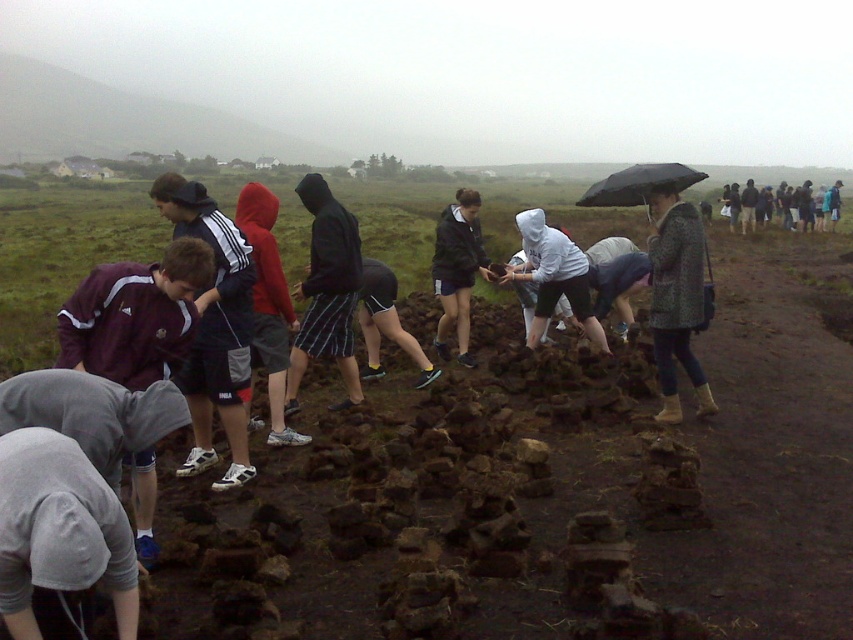
You are standing at the center of the image. Which direction should you look to see the maroon jersey at left?

The maroon jersey at left is located at point (215, 328), so you should look to the left side of the image to see it.

You are an archaeologist working on a dig site. You need to locate the damp brown dirt at center. Where exactly should you look?

The damp brown dirt at center is located at point (x=548, y=481).